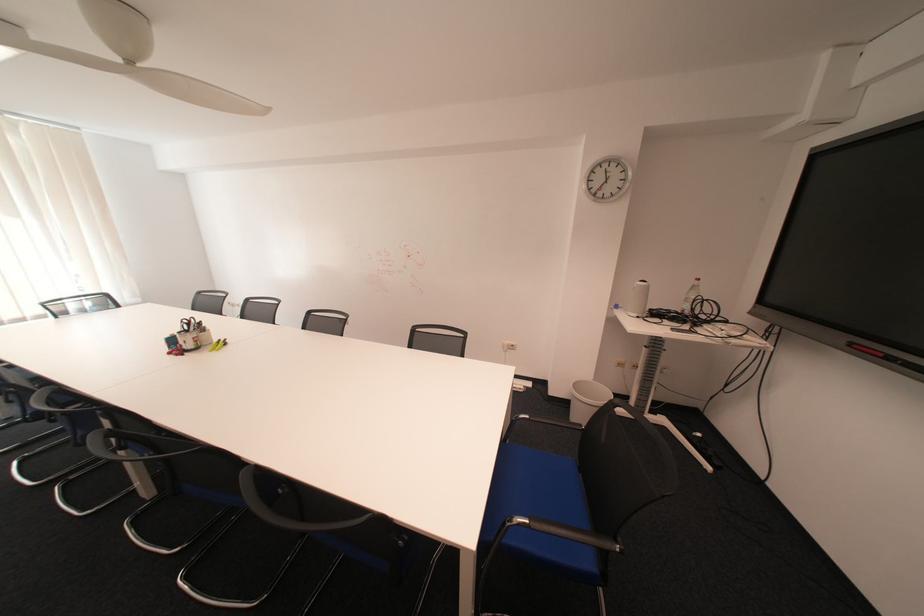
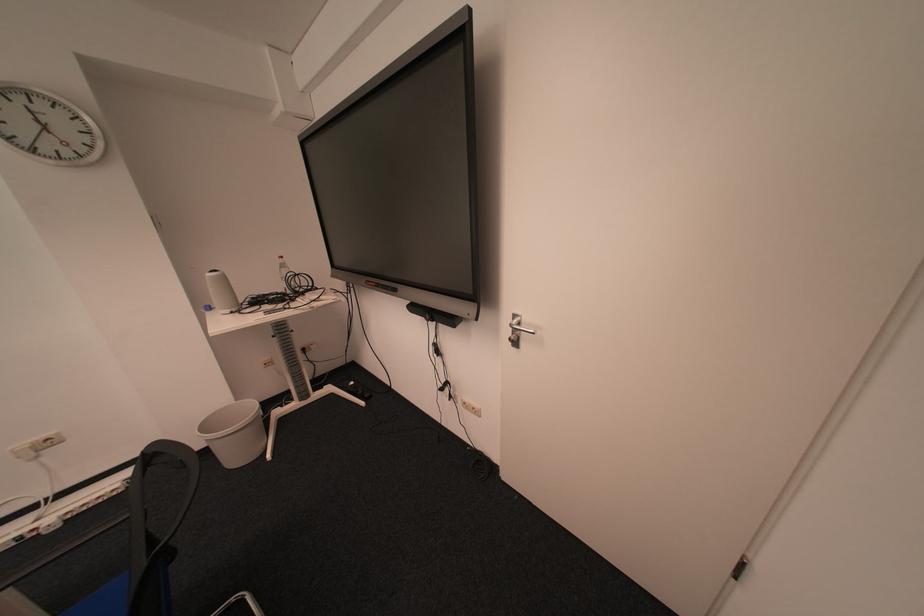
Question: I am providing you with two images of the same scene from different viewpoints. Which of the following objects are not visible in image2?

Choices:
 (A) plastic water bottle
 (B) white cylindrical speaker
 (C) white trash can
 (D) none of these

Answer: (D)